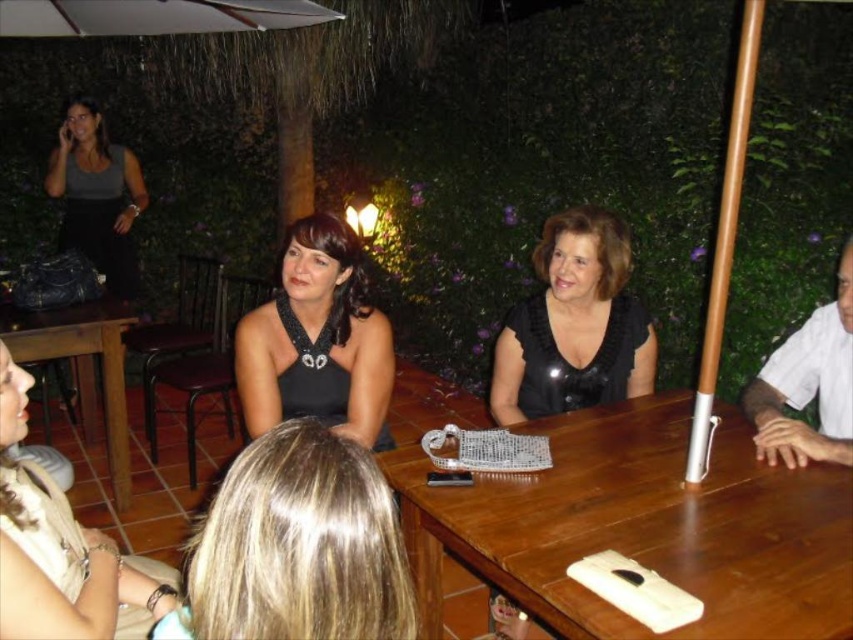
You are a photographer trying to capture a candid shot of the matte black dress at upper left and the brown wooden table at lower left. Since you want to ensure both are in focus, you need to know which object is taller. Can you tell me which one is taller?

The matte black dress at upper left is taller than the brown wooden table at lower left.

In the scene shown: You are a server at this evening gathering. You need to deliver a drink to the person with blonde hair at lower center who is seated at the brown wooden table at center. The tray you are carrying has a diameter of 18 inches. Can you safely place the tray on the table without it extending beyond the table edges?

The distance between the brown wooden table at center and blonde hair at lower center is 29.61 inches. Since the tray has a diameter of 18 inches, which is smaller than the distance between the table and the person, you can safely place the tray on the table without it extending beyond the table edges.

You are planning to place a decorative vase on the brown wooden table at lower left. Considering the presence of the blonde hair at lower center, will the vase fit on the table without overlapping the hair?

The blonde hair at lower center has a lesser width compared to the brown wooden table at lower left, so the vase can be placed on the brown wooden table at lower left without overlapping the hair as there is enough space.